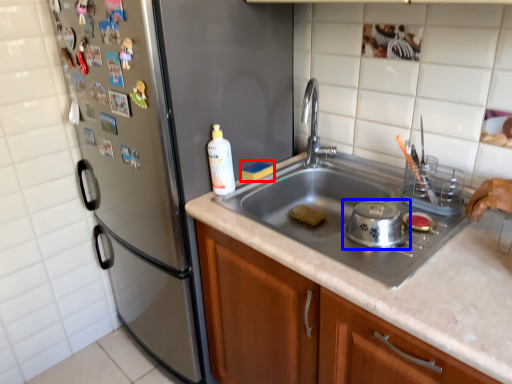
Question: Which object is further to the camera taking this photo, food (highlighted by a red box) or appliance (highlighted by a blue box)?

Choices:
 (A) food
 (B) appliance

Answer: (A)